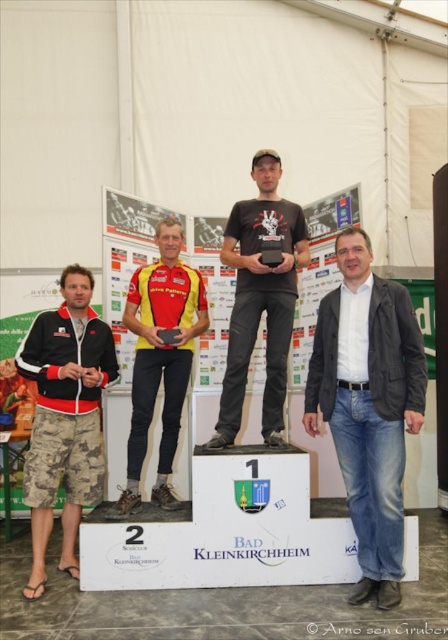
Which is in front, point (77, 460) or point (270, 384)?

Point (77, 460) is more forward.

Is point (43, 458) farther from viewer compared to point (276, 179)?

No, it is in front of (276, 179).

At what (x,y) coordinates should I click in order to perform the action: click on camouflage shorts at lower left. Please return your answer as a coordinate pair (x, y). Looking at the image, I should click on (64, 417).

Between dark gray blazer at center and yellow jersey at center, which one appears on the right side from the viewer's perspective?

dark gray blazer at center

You are a GUI agent. You are given a task and a screenshot of the screen. Output one action in this format:
    pyautogui.click(x=<x>, y=<y>)
    Task: Click on the dark gray blazer at center
    The height and width of the screenshot is (640, 448).
    Given the screenshot: What is the action you would take?
    pyautogui.click(x=369, y=404)

Is camouflage shorts at lower left below yellow jersey at center?

Correct, camouflage shorts at lower left is located below yellow jersey at center.

Which is behind, point (30, 353) or point (164, 481)?

Point (164, 481)

Locate an element on the screen. Image resolution: width=448 pixels, height=640 pixels. camouflage shorts at lower left is located at coordinates (64, 417).